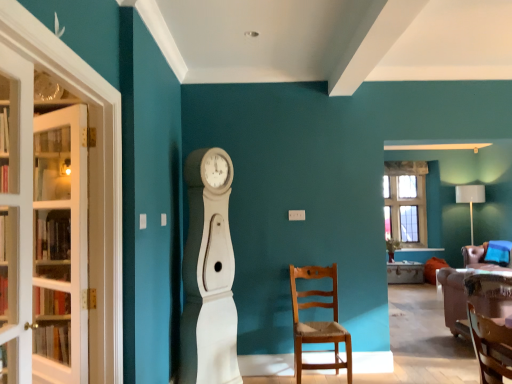
Question: Could you tell me if clear glass window at upper right is facing wooden chair at center, the 1th chair viewed from the right?

Choices:
 (A) no
 (B) yes

Answer: (A)

Question: Is clear glass window at upper right outside of wooden chair at center, the 1th chair viewed from the right?

Choices:
 (A) yes
 (B) no

Answer: (A)

Question: From the image's perspective, does clear glass window at upper right appear higher than wooden chair at center, the second chair viewed from the front?

Choices:
 (A) yes
 (B) no

Answer: (A)

Question: Is clear glass window at upper right to the right of wooden chair at center, the 2th chair positioned from the left, from the viewer's perspective?

Choices:
 (A) yes
 (B) no

Answer: (B)

Question: Does clear glass window at upper right have a smaller size compared to wooden chair at center, arranged as the first chair when viewed from the back?

Choices:
 (A) no
 (B) yes

Answer: (A)

Question: Does point (118, 332) appear closer or farther from the camera than point (309, 269)?

Choices:
 (A) closer
 (B) farther

Answer: (A)

Question: Is clear glass cabinet at left spatially inside wooden chair at center, the 2th chair viewed from the right, or outside of it?

Choices:
 (A) inside
 (B) outside

Answer: (B)

Question: Based on their sizes in the image, would you say clear glass cabinet at left is bigger or smaller than wooden chair at center, acting as the first chair starting from the front?

Choices:
 (A) small
 (B) big

Answer: (B)

Question: From a real-world perspective, is clear glass cabinet at left physically located above or below wooden chair at center, the 2th chair viewed from the right?

Choices:
 (A) above
 (B) below

Answer: (A)

Question: From the image's perspective, is white wood clock at center located above or below velvet brown sofa at lower right?

Choices:
 (A) above
 (B) below

Answer: (A)

Question: Would you say white wood clock at center is to the left or to the right of velvet brown sofa at lower right in the picture?

Choices:
 (A) left
 (B) right

Answer: (A)

Question: Considering the positions of white wood clock at center and velvet brown sofa at lower right in the image, is white wood clock at center taller or shorter than velvet brown sofa at lower right?

Choices:
 (A) tall
 (B) short

Answer: (A)

Question: Relative to velvet brown sofa at lower right, is white wood clock at center in front or behind?

Choices:
 (A) front
 (B) behind

Answer: (A)

Question: From the image's perspective, is wooden chair at center, positioned as the 2th chair in back-to-front order, located above or below white glass door at left, placed as the first door when sorted from front to back?

Choices:
 (A) above
 (B) below

Answer: (B)

Question: From a real-world perspective, is wooden chair at center, positioned as the 2th chair in back-to-front order, positioned above or below white glass door at left, the 1th door viewed from the right?

Choices:
 (A) above
 (B) below

Answer: (B)